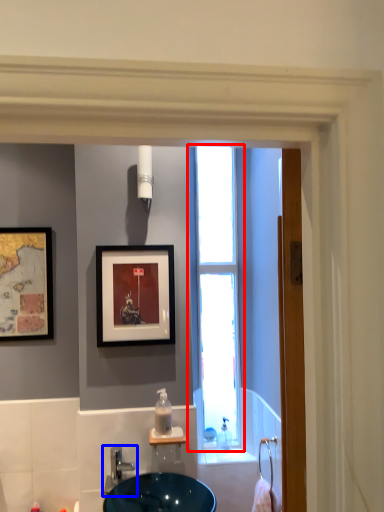
Question: Which object appears closest to the camera in this image, window (highlighted by a red box) or tap (highlighted by a blue box)?

Choices:
 (A) window
 (B) tap

Answer: (B)